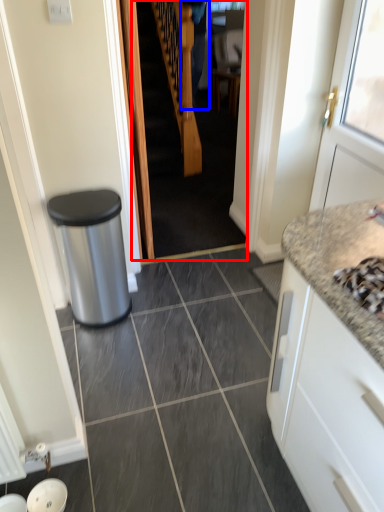
Question: Which of the following is the closest to the observer, stairwell (highlighted by a red box) or couple (highlighted by a blue box)?

Choices:
 (A) stairwell
 (B) couple

Answer: (A)